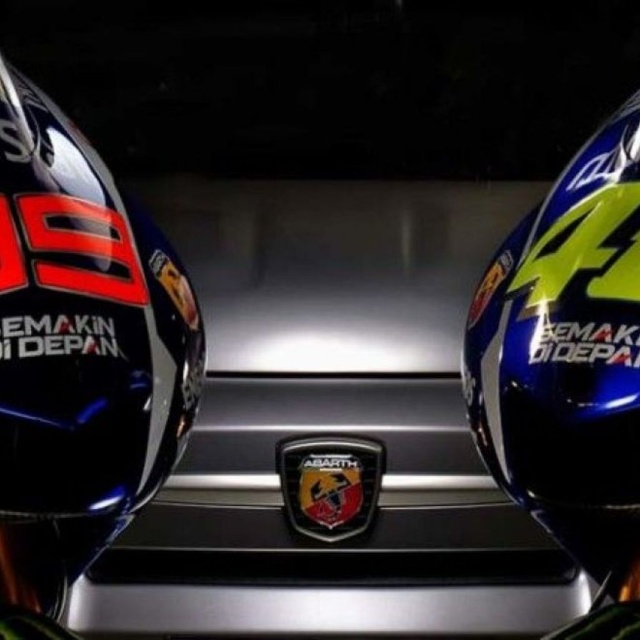
Question: Which object appears farthest from the camera in this image?

Choices:
 (A) blue glossy motorcycle helmet at right
 (B) glossy black helmet at left

Answer: (A)

Question: Among these points, which one is nearest to the camera?

Choices:
 (A) pos(598,250)
 (B) pos(35,483)

Answer: (B)

Question: Does glossy black helmet at left have a lesser width compared to blue glossy motorcycle helmet at right?

Choices:
 (A) no
 (B) yes

Answer: (B)

Question: Can you confirm if glossy black helmet at left is positioned below blue glossy motorcycle helmet at right?

Choices:
 (A) no
 (B) yes

Answer: (B)

Question: Can you confirm if glossy black helmet at left is bigger than blue glossy motorcycle helmet at right?

Choices:
 (A) yes
 (B) no

Answer: (B)